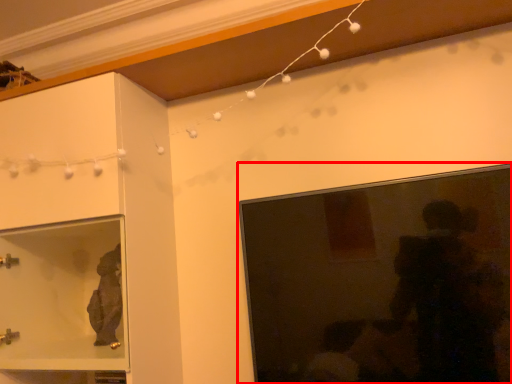
Question: From the image's perspective, what is the correct spatial relationship of picture frame (annotated by the red box) in relation to cabinetry?

Choices:
 (A) below
 (B) above

Answer: (A)